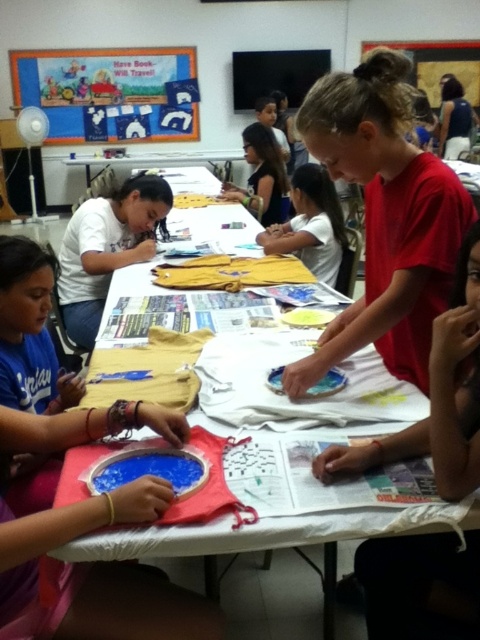
Question: Is white matte shirt at left further to the viewer compared to matte yellow shirt at upper center?

Choices:
 (A) no
 (B) yes

Answer: (A)

Question: From the image, what is the correct spatial relationship of blue fabric banner at upper left in relation to white matte shirt at center?

Choices:
 (A) right
 (B) left

Answer: (B)

Question: Can you confirm if blue fabric banner at upper left is positioned to the right of matte yellow shirt at upper center?

Choices:
 (A) no
 (B) yes

Answer: (A)

Question: Which object is the farthest from the white paper at center?

Choices:
 (A) blue fabric banner at upper left
 (B) red matte shirt at center
 (C) matte yellow shirt at upper center
 (D) white matte shirt at center

Answer: (A)

Question: Which point is closer to the camera taking this photo?

Choices:
 (A) (173, 58)
 (B) (274, 595)

Answer: (B)

Question: Which point appears farthest from the camera in this image?

Choices:
 (A) (248, 202)
 (B) (451, 237)
 (C) (284, 243)

Answer: (A)